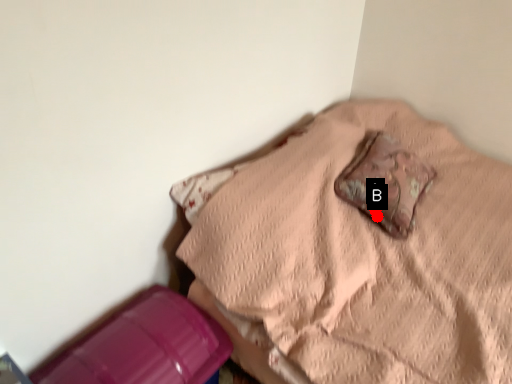
Question: Two points are circled on the image, labeled by A and B beside each circle. Which point is further to the camera?

Choices:
 (A) A is further
 (B) B is further

Answer: (B)